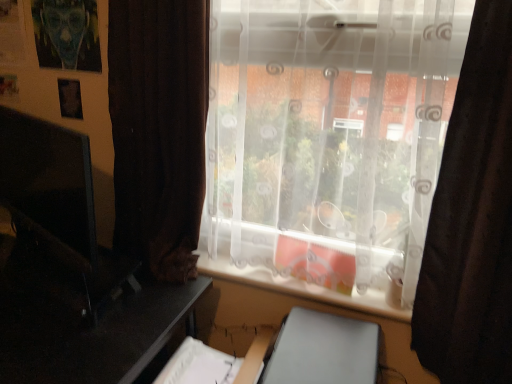
Where is `black glossy table at left`? The image size is (512, 384). black glossy table at left is located at coordinates (90, 335).

Measure the distance between white plastic window sill at center and camera.

They are 1.31 meters apart.

You are a GUI agent. You are given a task and a screenshot of the screen. Output one action in this format:
    pyautogui.click(x=<x>, y=<y>)
    Task: Click on the white plastic window sill at center
    This screenshot has width=512, height=384.
    Given the screenshot: What is the action you would take?
    pyautogui.click(x=301, y=287)

I want to click on black glossy table at left, so click(90, 335).

Which object is wider, black glossy table at left or brown fabric curtain at right?

black glossy table at left is wider.

What's the angular difference between black glossy table at left and brown fabric curtain at right's facing directions?

There is a 0.0753-degree angle between the facing directions of black glossy table at left and brown fabric curtain at right.

Measure the distance between black glossy table at left and brown fabric curtain at right.

black glossy table at left is 37.32 inches from brown fabric curtain at right.

Between black glossy table at left and brown fabric curtain at right, which one is positioned in front?

brown fabric curtain at right.

Which object is closer to the camera, brown fabric curtain at right or black glossy table at left?

Positioned in front is brown fabric curtain at right.

Is brown fabric curtain at right outside of black glossy table at left?

Absolutely, brown fabric curtain at right is external to black glossy table at left.

Can you confirm if brown fabric curtain at right is smaller than black glossy table at left?

Correct, brown fabric curtain at right occupies less space than black glossy table at left.

This screenshot has width=512, height=384. In order to click on table directly beneath the brown fabric curtain at right (from a real-world perspective) in this screenshot , I will do `click(90, 335)`.

Which of these two, white plastic window sill at center or black glossy table at left, is smaller?

white plastic window sill at center is smaller.

From the image's perspective, is white plastic window sill at center positioned above or below black glossy table at left?

white plastic window sill at center is above black glossy table at left.

What's the angular difference between white plastic window sill at center and black glossy table at left's facing directions?

There is a 0.075-degree angle between the facing directions of white plastic window sill at center and black glossy table at left.

Considering the relative sizes of white plastic window sill at center and brown fabric curtain at right in the image provided, is white plastic window sill at center taller than brown fabric curtain at right?

Incorrect, the height of white plastic window sill at center is not larger of that of brown fabric curtain at right.

Relative to brown fabric curtain at right, is white plastic window sill at center in front or behind?

white plastic window sill at center is behind brown fabric curtain at right.

Is point (397, 312) less distant than point (451, 339)?

No, (397, 312) is further to viewer.

Who is shorter, black glossy table at left or matte black monitor at left?

Standing shorter between the two is matte black monitor at left.

What's the angular difference between black glossy table at left and matte black monitor at left's facing directions?

20.2 degrees.

This screenshot has height=384, width=512. Find the location of `table lying on the left of matte black monitor at left`. table lying on the left of matte black monitor at left is located at coordinates (90, 335).

From a real-world perspective, who is located lower, black glossy table at left or transparent fabric at center?

black glossy table at left is physically lower.

Based on the photo, is black glossy table at left touching transparent fabric at center?

black glossy table at left is not next to transparent fabric at center, and they're not touching.

Is black glossy table at left located outside transparent fabric at center?

Indeed, black glossy table at left is completely outside transparent fabric at center.

Who is smaller, black glossy table at left or transparent fabric at center?

transparent fabric at center is smaller.

From a real-world perspective, is transparent fabric at center beneath matte black monitor at left?

Actually, transparent fabric at center is physically above matte black monitor at left in the real world.

Considering the relative positions of transparent fabric at center and matte black monitor at left in the image provided, is transparent fabric at center to the left or to the right of matte black monitor at left?

From the image, it's evident that transparent fabric at center is to the right of matte black monitor at left.

Is transparent fabric at center far away from matte black monitor at left?

They are positioned close to each other.

Where is `curtain that appears above the black glossy table at left (from a real-world perspective)`? The width and height of the screenshot is (512, 384). curtain that appears above the black glossy table at left (from a real-world perspective) is located at coordinates (472, 219).

Where is `curtain in front of the black glossy table at left`? The width and height of the screenshot is (512, 384). curtain in front of the black glossy table at left is located at coordinates (472, 219).

From the image, which object appears to be nearer to brown fabric curtain at right, transparent fabric at center or white plastic window sill at center?

transparent fabric at center lies closer to brown fabric curtain at right than the other object.

Based on their spatial positions, is white plastic window sill at center or black glossy table at left further from matte black monitor at left?

white plastic window sill at center lies further to matte black monitor at left than the other object.

Looking at the image, which one is located closer to transparent fabric at center, brown fabric curtain at right or matte black monitor at left?

The object closer to transparent fabric at center is brown fabric curtain at right.

Considering their positions, is transparent fabric at center positioned closer to black glossy table at left than white plastic window sill at center?

white plastic window sill at center.

Consider the image. Considering their positions, is brown fabric curtain at right positioned closer to white plastic window sill at center than matte black monitor at left?

Based on the image, brown fabric curtain at right appears to be nearer to white plastic window sill at center.

Which object lies further to the anchor point white plastic window sill at center, matte black monitor at left or transparent fabric at center?

Among the two, matte black monitor at left is located further to white plastic window sill at center.

Considering their positions, is black glossy table at left positioned closer to matte black monitor at left than white plastic window sill at center?

black glossy table at left is positioned closer to the anchor matte black monitor at left.

From the image, which object appears to be farther from brown fabric curtain at right, matte black monitor at left or black glossy table at left?

Based on the image, matte black monitor at left appears to be further to brown fabric curtain at right.

The width and height of the screenshot is (512, 384). I want to click on window sill between matte black monitor at left and transparent fabric at center from left to right, so click(301, 287).

Identify the location of computer monitor between black glossy table at left and white plastic window sill at center. Image resolution: width=512 pixels, height=384 pixels. [50, 185].

The image size is (512, 384). In order to click on computer monitor between black glossy table at left and transparent fabric at center from left to right in this screenshot , I will do `click(50, 185)`.

This screenshot has height=384, width=512. In order to click on window between brown fabric curtain at right and white plastic window sill at center along the z-axis in this screenshot , I will do `click(329, 139)`.